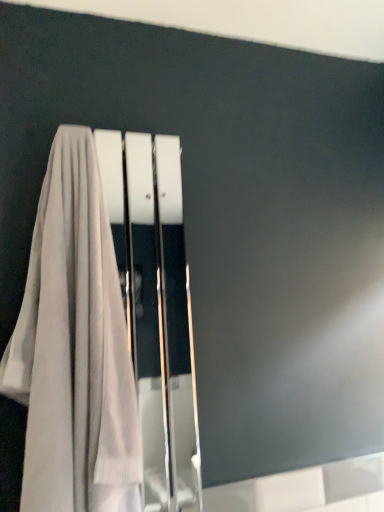
Question: Is light beige fabric towel at left positioned with its back to white glossy screen door at center?

Choices:
 (A) no
 (B) yes

Answer: (B)

Question: Considering the relative sizes of light beige fabric towel at left and white glossy screen door at center in the image provided, is light beige fabric towel at left bigger than white glossy screen door at center?

Choices:
 (A) no
 (B) yes

Answer: (B)

Question: Does light beige fabric towel at left appear on the left side of white glossy screen door at center?

Choices:
 (A) no
 (B) yes

Answer: (B)

Question: Is light beige fabric towel at left oriented towards white glossy screen door at center?

Choices:
 (A) yes
 (B) no

Answer: (B)

Question: From a real-world perspective, is light beige fabric towel at left beneath white glossy screen door at center?

Choices:
 (A) no
 (B) yes

Answer: (A)

Question: Is light beige fabric towel at left to the right of white glossy screen door at center from the viewer's perspective?

Choices:
 (A) yes
 (B) no

Answer: (B)

Question: Can you confirm if white glossy screen door at center is positioned to the right of light beige fabric towel at left?

Choices:
 (A) yes
 (B) no

Answer: (A)

Question: Considering the relative sizes of white glossy screen door at center and light beige fabric towel at left in the image provided, is white glossy screen door at center shorter than light beige fabric towel at left?

Choices:
 (A) yes
 (B) no

Answer: (B)

Question: Is white glossy screen door at center directly adjacent to light beige fabric towel at left?

Choices:
 (A) yes
 (B) no

Answer: (B)

Question: Considering the relative sizes of white glossy screen door at center and light beige fabric towel at left in the image provided, is white glossy screen door at center thinner than light beige fabric towel at left?

Choices:
 (A) no
 (B) yes

Answer: (B)

Question: Considering the relative sizes of white glossy screen door at center and light beige fabric towel at left in the image provided, is white glossy screen door at center taller than light beige fabric towel at left?

Choices:
 (A) no
 (B) yes

Answer: (B)

Question: Does white glossy screen door at center have a smaller size compared to light beige fabric towel at left?

Choices:
 (A) yes
 (B) no

Answer: (A)

Question: From a real-world perspective, is white glossy screen door at center physically located above or below light beige fabric towel at left?

Choices:
 (A) above
 (B) below

Answer: (B)